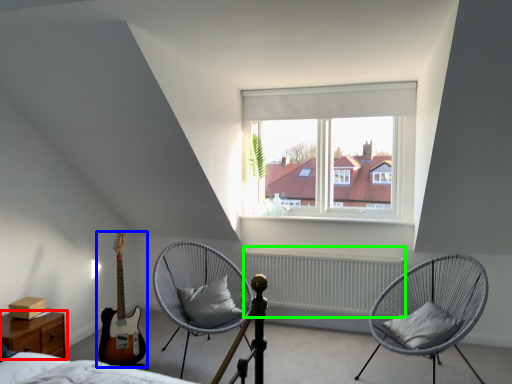
Question: Which object is positioned closest to nightstand (highlighted by a red box)? Select from guitar (highlighted by a blue box) and radiator (highlighted by a green box).

Choices:
 (A) guitar
 (B) radiator

Answer: (A)